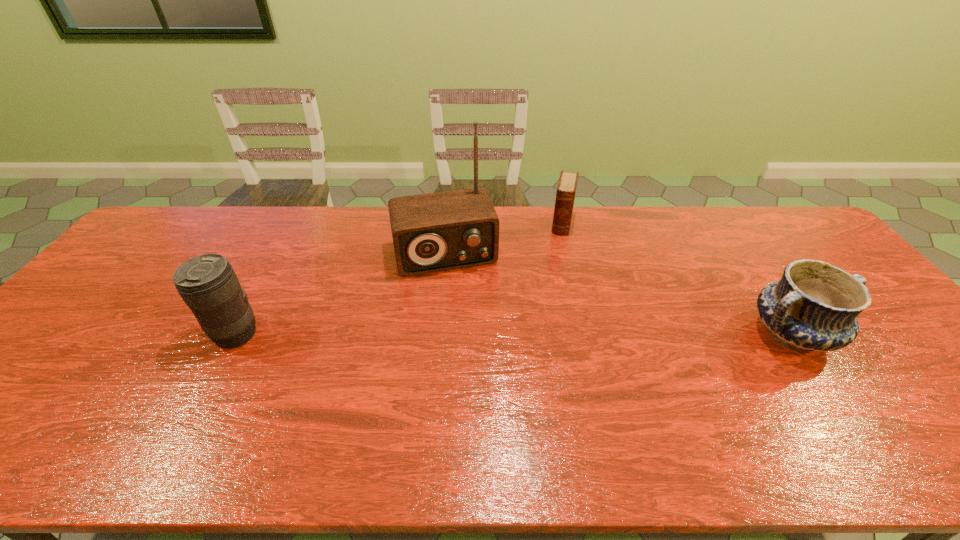
Locate an element on the screen. the third shortest object is located at coordinates (208, 285).

Image resolution: width=960 pixels, height=540 pixels. I want to click on telephoto lens, so click(x=208, y=285).

I want to click on the rightmost object, so click(x=815, y=305).

Locate an element on the screen. The image size is (960, 540). the tallest object is located at coordinates (x=433, y=232).

Where is `the second object from left to right`? the second object from left to right is located at coordinates (433, 232).

Locate an element on the screen. This screenshot has width=960, height=540. the second object from right to left is located at coordinates (566, 189).

Identify the location of free space located 0.080m on the side of the telephoto lens where the control switches are located. The height and width of the screenshot is (540, 960). (181, 334).

This screenshot has height=540, width=960. I want to click on vacant space situated on the side of the telephoto lens where the control switches are located, so click(x=97, y=334).

This screenshot has height=540, width=960. I want to click on free region located 0.050m on the side of the telephoto lens where the control switches are located, so click(193, 334).

This screenshot has width=960, height=540. In order to click on free location located on the right of the pottery in this screenshot , I will do `click(878, 334)`.